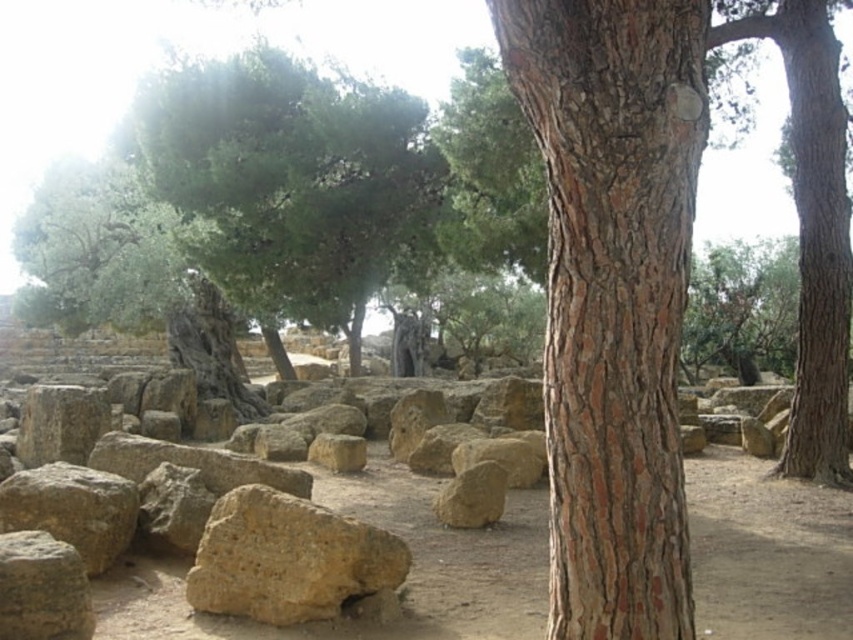
Which is more to the right, brown rough tree trunk at right or brown rough rock at lower left?

From the viewer's perspective, brown rough tree trunk at right appears more on the right side.

Who is lower down, brown rough tree trunk at right or brown rough rock at lower left?

Positioned lower is brown rough rock at lower left.

The height and width of the screenshot is (640, 853). I want to click on brown rough tree trunk at right, so click(817, 241).

What do you see at coordinates (405, 579) in the screenshot? The image size is (853, 640). I see `brown dirt field at center` at bounding box center [405, 579].

I want to click on brown dirt field at center, so click(x=405, y=579).

Does brown rough rock at lower left have a lesser width compared to brown rough stone at lower left?

Incorrect, brown rough rock at lower left's width is not less than brown rough stone at lower left's.

Is brown rough rock at lower left shorter than brown rough stone at lower left?

Incorrect, brown rough rock at lower left's height does not fall short of brown rough stone at lower left's.

Is point (0, 486) more distant than point (24, 531)?

Yes.

At what (x,y) coordinates should I click in order to perform the action: click on brown rough rock at lower left. Please return your answer as a coordinate pair (x, y). The width and height of the screenshot is (853, 640). Looking at the image, I should click on (73, 509).